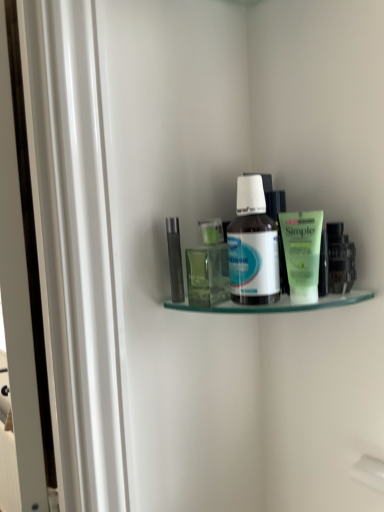
Question: Considering the relative sizes of clear glass shelf at upper center and green matte tube at upper right, marked as the 3th toiletry in a left-to-right arrangement, in the image provided, is clear glass shelf at upper center taller than green matte tube at upper right, marked as the 3th toiletry in a left-to-right arrangement,?

Choices:
 (A) no
 (B) yes

Answer: (A)

Question: Does clear glass shelf at upper center have a greater width compared to green matte tube at upper right, marked as the 3th toiletry in a left-to-right arrangement?

Choices:
 (A) yes
 (B) no

Answer: (A)

Question: Considering the relative sizes of clear glass shelf at upper center and green matte tube at upper right, marked as the 3th toiletry in a left-to-right arrangement, in the image provided, is clear glass shelf at upper center thinner than green matte tube at upper right, marked as the 3th toiletry in a left-to-right arrangement,?

Choices:
 (A) no
 (B) yes

Answer: (A)

Question: Does clear glass shelf at upper center have a lesser height compared to green matte tube at upper right, which is the second toiletry in right-to-left order?

Choices:
 (A) no
 (B) yes

Answer: (B)

Question: Is clear glass shelf at upper center to the left of green matte tube at upper right, marked as the 3th toiletry in a left-to-right arrangement, from the viewer's perspective?

Choices:
 (A) no
 (B) yes

Answer: (B)

Question: Could green matte tube at upper right, marked as the 3th toiletry in a left-to-right arrangement, be considered to be inside clear glass shelf at upper center?

Choices:
 (A) no
 (B) yes

Answer: (A)

Question: Would you say green matte tube at upper right, which is the second toiletry in right-to-left order, is outside clear glass shelf at upper center?

Choices:
 (A) no
 (B) yes

Answer: (B)

Question: Can you confirm if green matte tube at upper right, marked as the 3th toiletry in a left-to-right arrangement, is taller than clear glass shelf at upper center?

Choices:
 (A) yes
 (B) no

Answer: (A)

Question: Can you confirm if green matte tube at upper right, marked as the 3th toiletry in a left-to-right arrangement, is shorter than clear glass shelf at upper center?

Choices:
 (A) no
 (B) yes

Answer: (A)

Question: Does green matte tube at upper right, marked as the 3th toiletry in a left-to-right arrangement, have a lesser width compared to clear glass shelf at upper center?

Choices:
 (A) yes
 (B) no

Answer: (A)

Question: Is the position of green matte tube at upper right, which is the second toiletry in right-to-left order, less distant than that of clear glass shelf at upper center?

Choices:
 (A) no
 (B) yes

Answer: (A)

Question: Considering the relative sizes of green matte tube at upper right, marked as the 3th toiletry in a left-to-right arrangement, and clear glass shelf at upper center in the image provided, is green matte tube at upper right, marked as the 3th toiletry in a left-to-right arrangement, smaller than clear glass shelf at upper center?

Choices:
 (A) yes
 (B) no

Answer: (A)

Question: Does clear glass shelf at upper center have a greater height compared to green matte tube at right, which ranks as the first toiletry in right-to-left order?

Choices:
 (A) no
 (B) yes

Answer: (A)